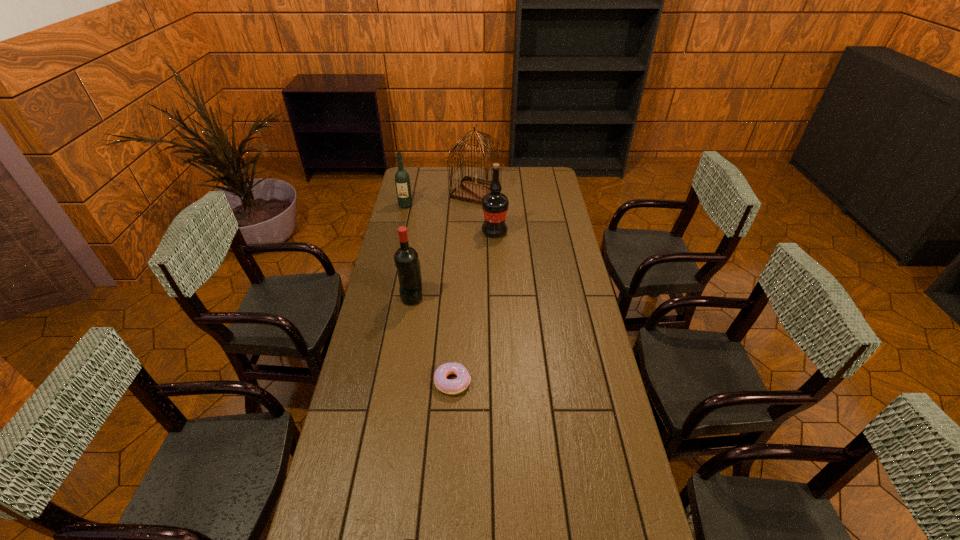
The height and width of the screenshot is (540, 960). I want to click on vacant region located on the right of the fourth nearest object, so click(x=553, y=232).

You are a GUI agent. You are given a task and a screenshot of the screen. Output one action in this format:
    pyautogui.click(x=<x>, y=<y>)
    Task: Click on the vacant point located 0.080m on the front of the third nearest object
    This screenshot has height=540, width=960.
    Given the screenshot: What is the action you would take?
    pyautogui.click(x=408, y=322)

The image size is (960, 540). I want to click on vacant space located on the labeled side of the farthest wine bottle, so click(398, 234).

Locate an element on the screen. The height and width of the screenshot is (540, 960). vacant space situated on the right of the fifth farthest object is located at coordinates (544, 382).

Identify the location of object that is at the far edge. The image size is (960, 540). tap(471, 189).

You are a GUI agent. You are given a task and a screenshot of the screen. Output one action in this format:
    pyautogui.click(x=<x>, y=<y>)
    Task: Click on the vacant point at the far edge
    
    Given the screenshot: What is the action you would take?
    pyautogui.click(x=509, y=188)

At what (x,y) coordinates should I click in order to perform the action: click on free space at the left edge. Please return your answer as a coordinate pair (x, y). The image size is (960, 540). Looking at the image, I should click on (365, 367).

In the image, there is a desktop. In order to click on vacant area at the right edge in this screenshot , I will do `click(541, 193)`.

At what (x,y) coordinates should I click in order to perform the action: click on blank region between the leftmost wine bottle and the doughnut. Please return your answer as a coordinate pair (x, y). Image resolution: width=960 pixels, height=540 pixels. Looking at the image, I should click on (429, 293).

Locate an element on the screen. This screenshot has height=540, width=960. vacant space that's between the birdcage and the fifth object from right to left is located at coordinates (444, 245).